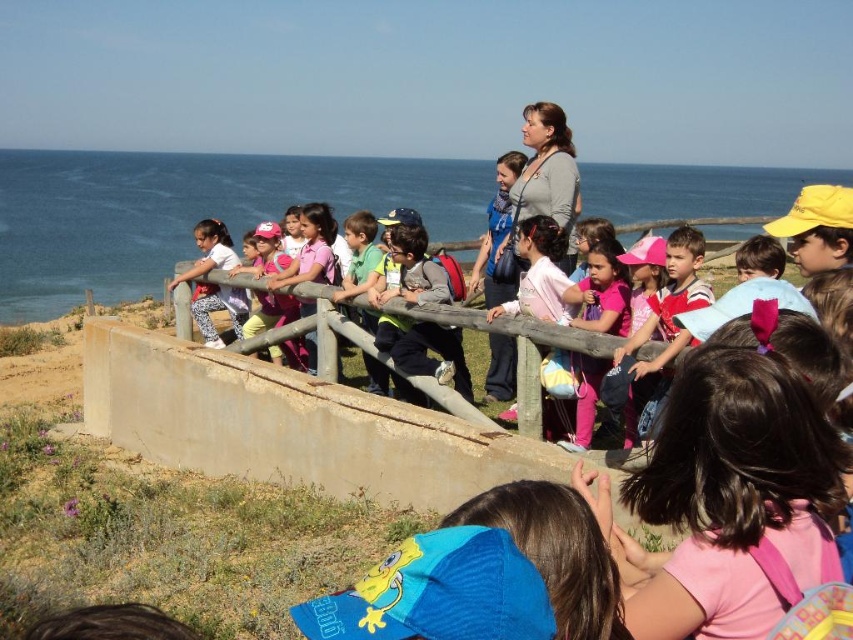
You are a photographer standing at the scenic overlook. You want to capture a photo of the matte gray backpack at center and the matte pink pants at left. Which object should you focus on first if you want to ensure both are in sharp focus?

The matte gray backpack at center is positioned under the matte pink pants at left, so focusing on the matte pink pants at left first will help ensure both are in sharp focus since it is closer to the camera.